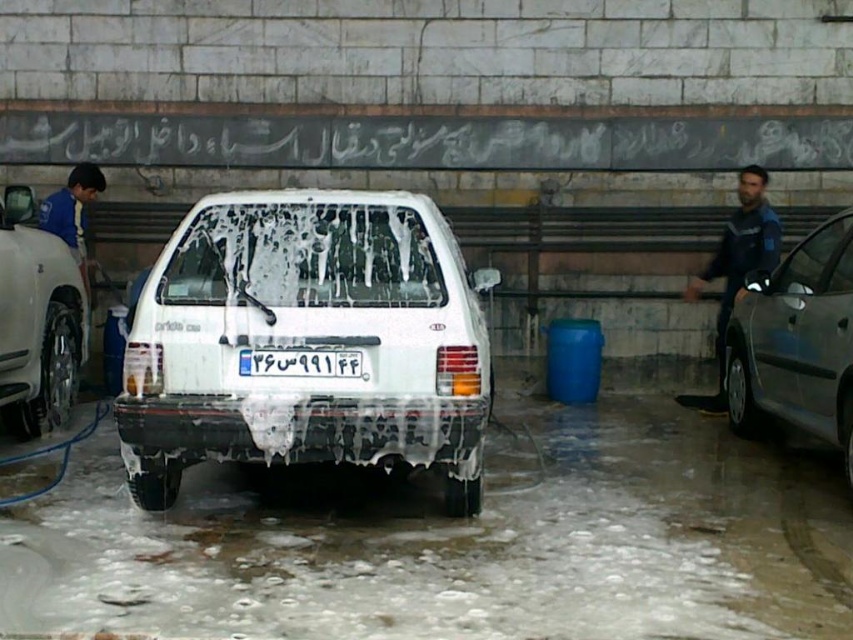
Between silver metallic sedan at right and blue fabric shirt at left, which one has more height?

silver metallic sedan at right is taller.

Which is more to the left, silver metallic sedan at right or blue fabric shirt at left?

blue fabric shirt at left is more to the left.

Which is in front, point (842, 269) or point (90, 193)?

Point (842, 269) is more forward.

Find the location of `silver metallic sedan at right`. silver metallic sedan at right is located at coordinates (798, 342).

Is point (312, 310) farther from camera compared to point (766, 330)?

That is False.

Consider the image. Does white matte car at center appear on the right side of silver metallic sedan at right?

No, white matte car at center is not to the right of silver metallic sedan at right.

Is point (262, 344) positioned after point (776, 413)?

No.

The width and height of the screenshot is (853, 640). I want to click on white matte car at center, so click(x=308, y=340).

Who is taller, blue denim jeans at right or blue fabric shirt at left?

blue denim jeans at right

Between blue denim jeans at right and blue fabric shirt at left, which one is positioned lower?

blue denim jeans at right

Does point (747, 193) come behind point (67, 193)?

No, it is not.

Locate an element on the screen. This screenshot has height=640, width=853. blue denim jeans at right is located at coordinates (735, 266).